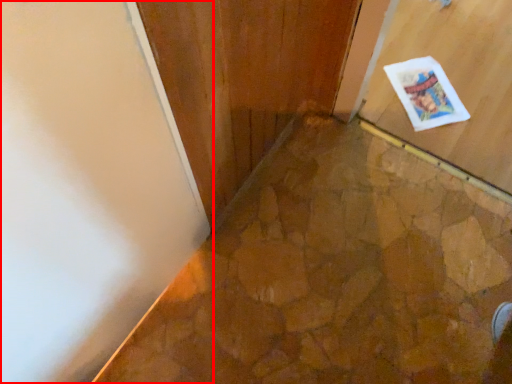
Question: From the image's perspective, where is door (annotated by the red box) located in relation to postcard in the image?

Choices:
 (A) below
 (B) above

Answer: (A)